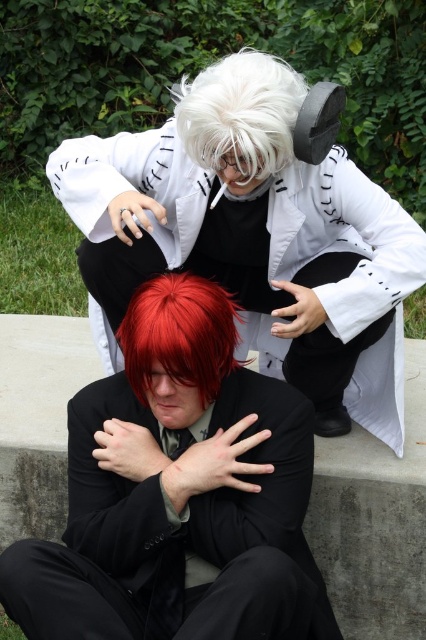
Question: Considering the relative positions of white matte coat at upper center and shiny black suit at lower center in the image provided, where is white matte coat at upper center located with respect to shiny black suit at lower center?

Choices:
 (A) right
 (B) left

Answer: (A)

Question: Is white matte wig at upper center positioned in front of shiny red hair at center?

Choices:
 (A) no
 (B) yes

Answer: (A)

Question: Among these points, which one is nearest to the camera?

Choices:
 (A) (181, 275)
 (B) (218, 131)

Answer: (B)

Question: Which point is farther from the camera taking this photo?

Choices:
 (A) (227, 468)
 (B) (135, 317)

Answer: (B)

Question: Is shiny black suit at lower center wider than shiny red hair at center?

Choices:
 (A) no
 (B) yes

Answer: (B)

Question: Which object appears closest to the camera in this image?

Choices:
 (A) shiny black suit at lower center
 (B) white matte wig at upper center
 (C) shiny red hair at center
 (D) white matte coat at upper center

Answer: (A)